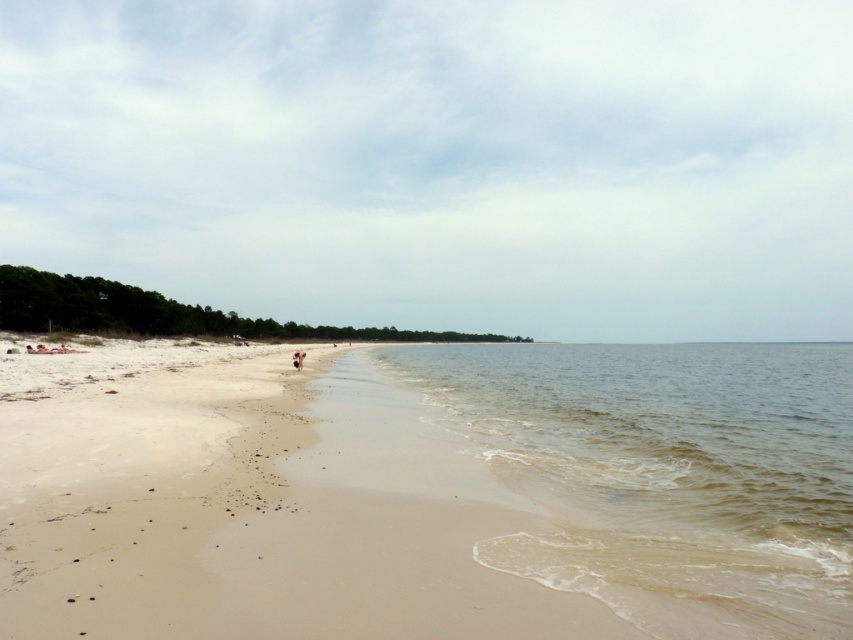
Describe the element at coordinates (253, 515) in the screenshot. The image size is (853, 640). I see `sandy beach at lower left` at that location.

Between point (463, 554) and point (779, 499), which one is positioned behind?

The point (779, 499) is more distant.

Measure the distance between sandy beach at lower left and camera.

They are 4.54 meters apart.

Identify the location of sandy beach at lower left. The height and width of the screenshot is (640, 853). (253, 515).